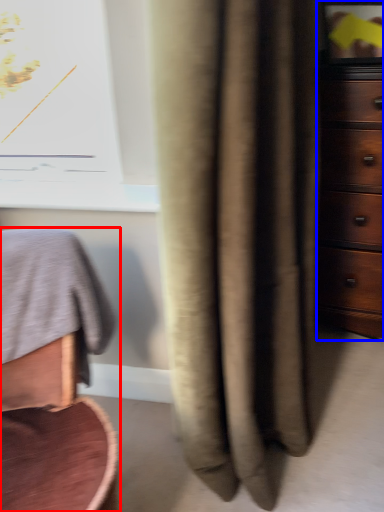
Question: Which object appears closest to the camera in this image, furniture (highlighted by a red box) or chest of drawers (highlighted by a blue box)?

Choices:
 (A) furniture
 (B) chest of drawers

Answer: (A)